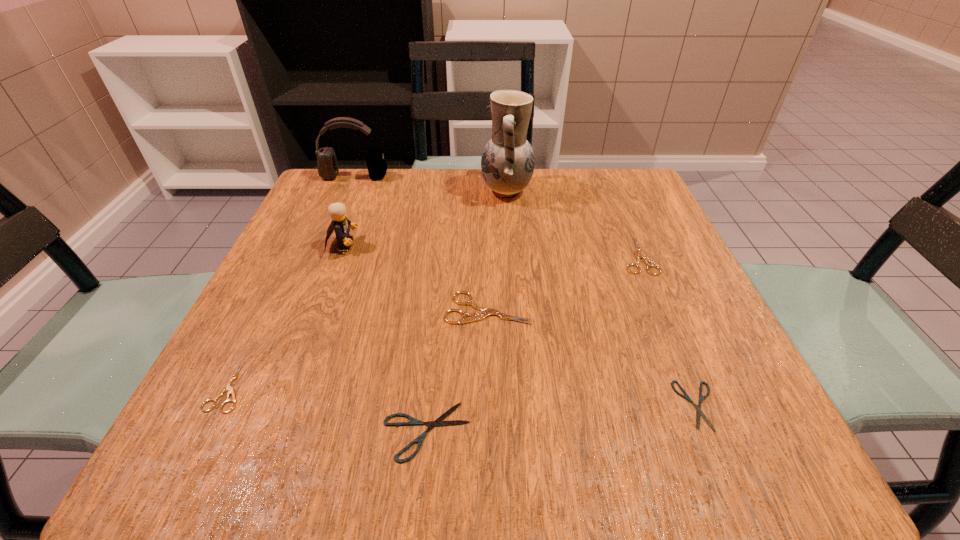
Identify which beige shears is the second nearest to the headset. Please provide its 2D coordinates. Your answer should be formatted as a tuple, i.e. [(x, y)], where the tuple contains the x and y coordinates of a point satisfying the conditions above.

[(227, 387)]

I want to click on beige shears that is the third nearest to the shortest object, so click(x=227, y=387).

Where is `vacant region that satisfies the following two spatial constraints: 1. on the headband of the headset; 2. on the left side of the fourth shortest object`? This screenshot has width=960, height=540. vacant region that satisfies the following two spatial constraints: 1. on the headband of the headset; 2. on the left side of the fourth shortest object is located at coordinates (322, 256).

Identify the location of vacant region that satisfies the following two spatial constraints: 1. on the front-facing side of the Lego; 2. on the back side of the second farthest beige shears. The width and height of the screenshot is (960, 540). (319, 308).

Image resolution: width=960 pixels, height=540 pixels. Identify the location of free space that satisfies the following two spatial constraints: 1. on either side of the pottery; 2. on the right side of the shortest shears. (524, 406).